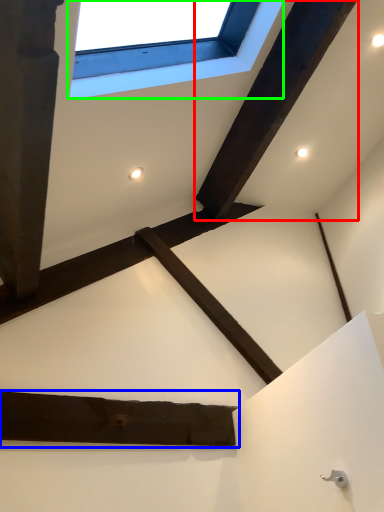
Question: Which is nearer to the plank (highlighted by a red box)? plank (highlighted by a blue box) or window (highlighted by a green box).

Choices:
 (A) plank
 (B) window

Answer: (B)